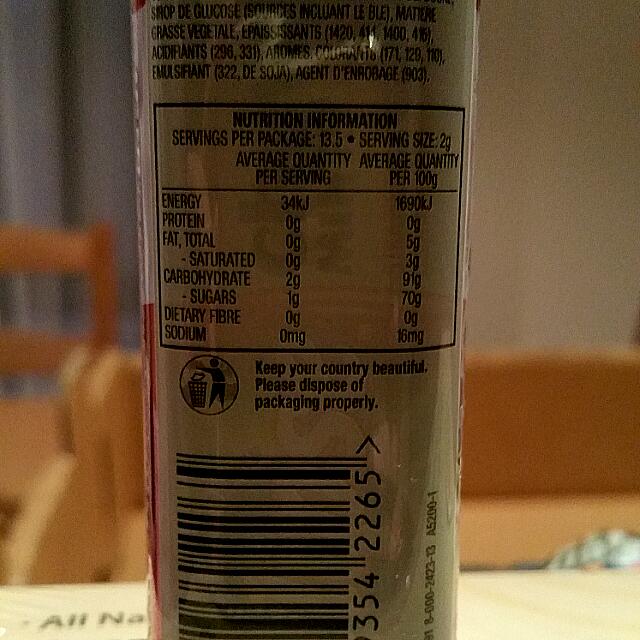
Locate an element on the screen. This screenshot has height=640, width=640. blurry chair is located at coordinates (61, 250).